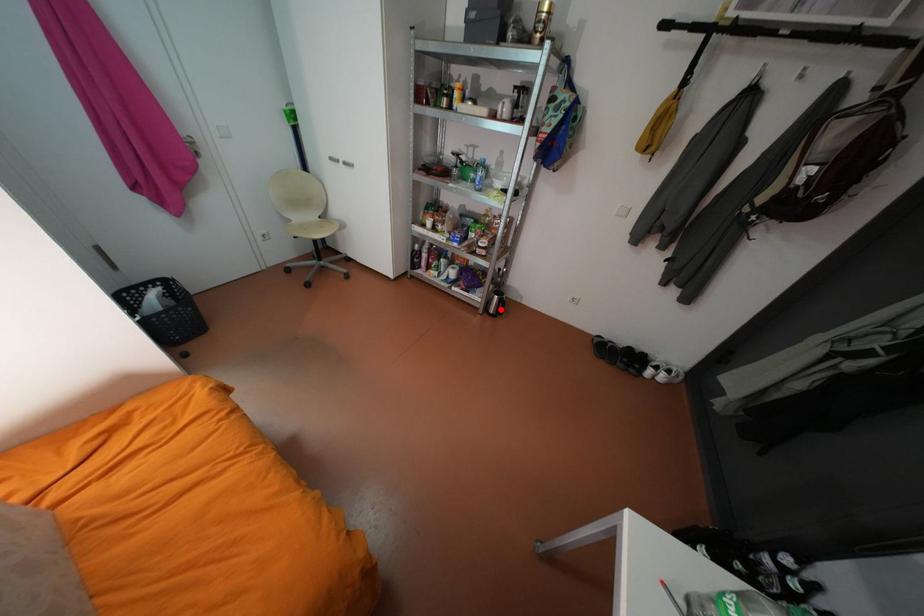
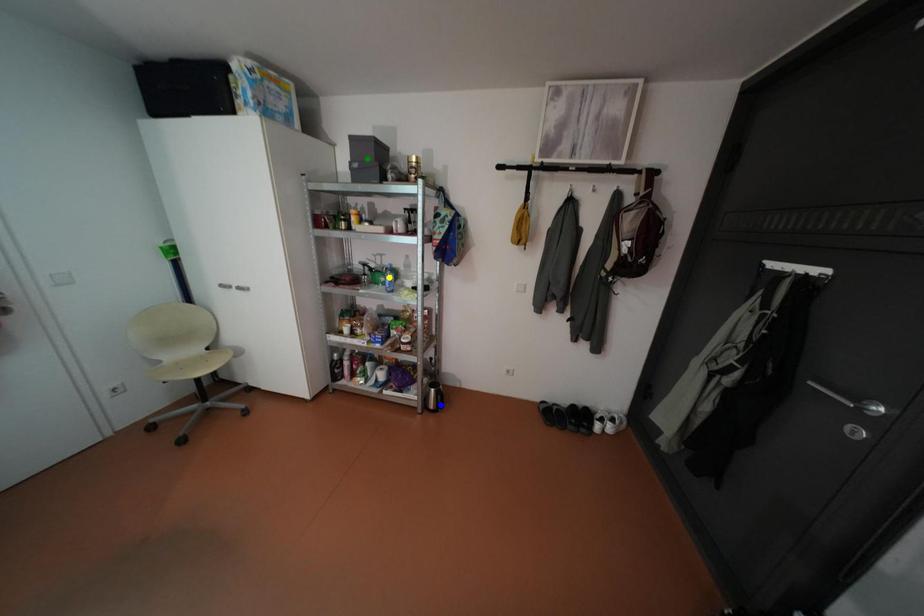
Question: I am providing you with two images of the same scene from different viewpoints. A red point is marked on the first image. You are given multiple points on the second image. Which point in image 2 is actually the same real-world point as the red point in image 1?

Choices:
 (A) yellow point
 (B) green point
 (C) blue point

Answer: (C)